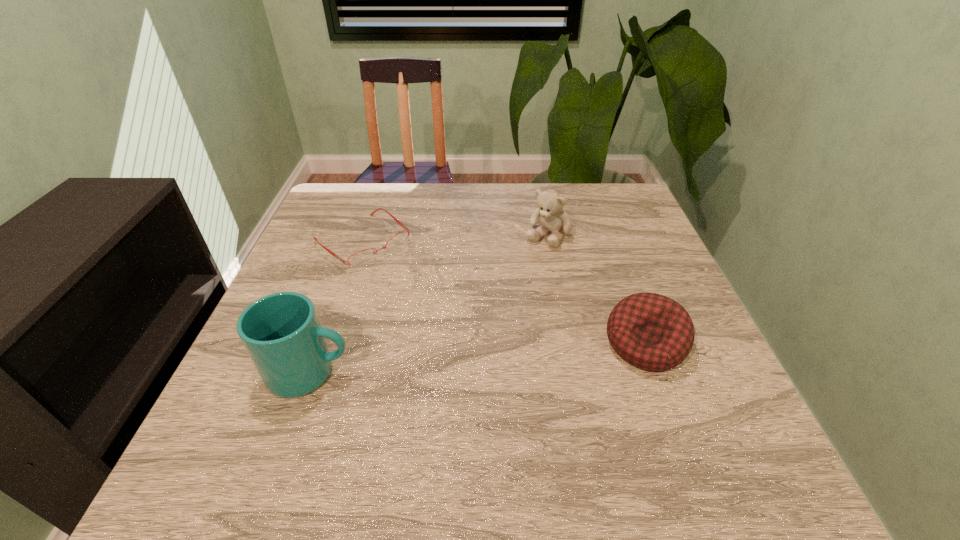
At what (x,y) coordinates should I click in order to perform the action: click on cup. Please return your answer as a coordinate pair (x, y). This screenshot has width=960, height=540. Looking at the image, I should click on (281, 332).

Identify the location of the rightmost object. The image size is (960, 540). (652, 332).

Locate an element on the screen. beanbag is located at coordinates (652, 332).

I want to click on the second object from right to left, so click(x=552, y=219).

Find the location of a particular element. The height and width of the screenshot is (540, 960). the shortest object is located at coordinates (364, 257).

At what (x,y) coordinates should I click in order to perform the action: click on vacant space located 0.380m on the handle side of the cup. Please return your answer as a coordinate pair (x, y). This screenshot has height=540, width=960. Looking at the image, I should click on (552, 373).

The width and height of the screenshot is (960, 540). Find the location of `free space located on the left of the beanbag`. free space located on the left of the beanbag is located at coordinates (536, 343).

Where is `free space located on the face of the third object from left to right`? The height and width of the screenshot is (540, 960). free space located on the face of the third object from left to right is located at coordinates (492, 309).

Locate an element on the screen. Image resolution: width=960 pixels, height=540 pixels. free location located on the face of the third object from left to right is located at coordinates (465, 346).

The width and height of the screenshot is (960, 540). I want to click on vacant space located on the face of the third object from left to right, so click(x=519, y=273).